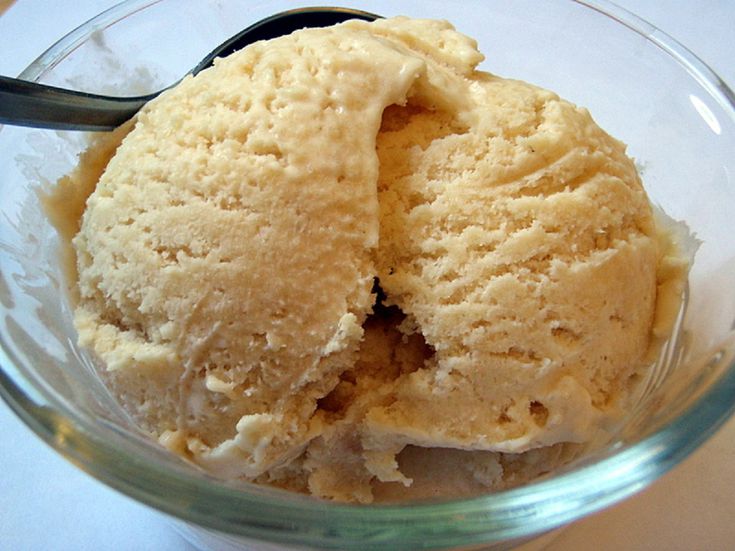
Locate an element on the screen. glass bowl is located at coordinates (509, 475).